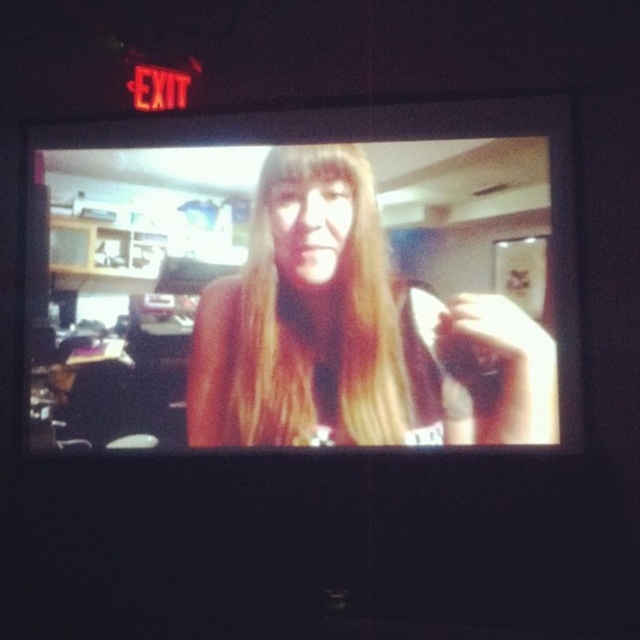
Can you confirm if smooth skin face at center is wider than blonde hair at center?

Indeed, smooth skin face at center has a greater width compared to blonde hair at center.

Is smooth skin face at center positioned in front of blonde hair at center?

Yes, smooth skin face at center is closer to the viewer.

This screenshot has width=640, height=640. What do you see at coordinates (307, 278) in the screenshot? I see `smooth skin face at center` at bounding box center [307, 278].

Find the location of `smooth skin face at center`. smooth skin face at center is located at coordinates (307, 278).

Can you confirm if blonde silky hair at center is bigger than blonde hair at center?

Indeed, blonde silky hair at center has a larger size compared to blonde hair at center.

Between blonde silky hair at center and blonde hair at center, which one appears on the left side from the viewer's perspective?

blonde hair at center is more to the left.

At what (x,y) coordinates should I click in order to perform the action: click on blonde silky hair at center. Please return your answer as a coordinate pair (x, y). Image resolution: width=640 pixels, height=640 pixels. Looking at the image, I should click on (320, 317).

Does smooth skin face at center have a lesser height compared to blonde silky hair at center?

No.

Is smooth skin face at center positioned in front of blonde silky hair at center?

Yes, smooth skin face at center is closer to the viewer.

Image resolution: width=640 pixels, height=640 pixels. Find the location of `smooth skin face at center`. smooth skin face at center is located at coordinates (307, 278).